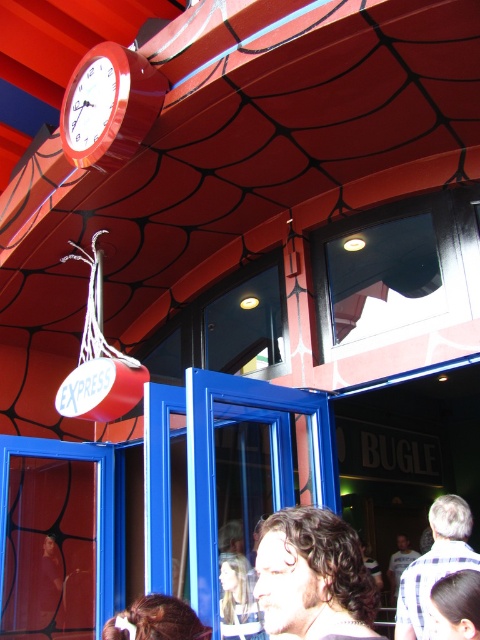
You are a visitor standing in front of the Spider Man themed entrance. You see the dark curly hair at center and the transparent glass window at center. Which one is shorter?

The dark curly hair at center is shorter than the transparent glass window at center.

You are standing in front of the Spider Man themed venue and want to take a photo of the clock on the ceiling. You are currently at a point with coordinates point (188, 371). If your camera can focus on objects within 10 feet, will you be able to capture the clock clearly?

The distance of point (188, 371) from camera is 11.37 feet, which is beyond the camera focus range of 10 feet. Therefore, you won not be able to capture the clock clearly.